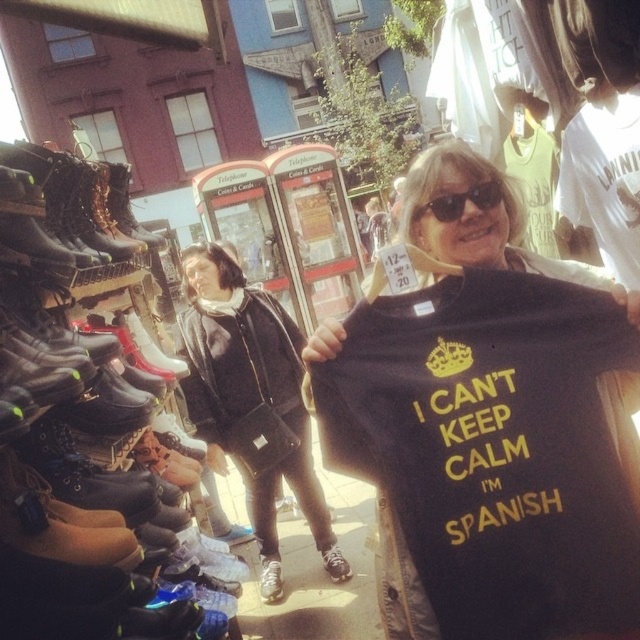
Who is shorter, black leather jacket at center or black matte t-shirt at center?

black matte t-shirt at center

Which is behind, point (266, 416) or point (456, 259)?

Positioned behind is point (266, 416).

Image resolution: width=640 pixels, height=640 pixels. I want to click on black leather jacket at center, so click(248, 390).

Does leather boots at left appear on the left side of black matte t-shirt at center?

Correct, you'll find leather boots at left to the left of black matte t-shirt at center.

Can you confirm if leather boots at left is smaller than black matte t-shirt at center?

No, leather boots at left is not smaller than black matte t-shirt at center.

Find the location of `leather boots at left`. leather boots at left is located at coordinates (74, 422).

Which is more to the right, black leather jacket at center or black plastic sunglasses at upper center?

From the viewer's perspective, black plastic sunglasses at upper center appears more on the right side.

Who is more forward, (198, 401) or (465, 189)?

Point (465, 189) is in front.

Find the location of a particular element. The width and height of the screenshot is (640, 640). black leather jacket at center is located at coordinates (248, 390).